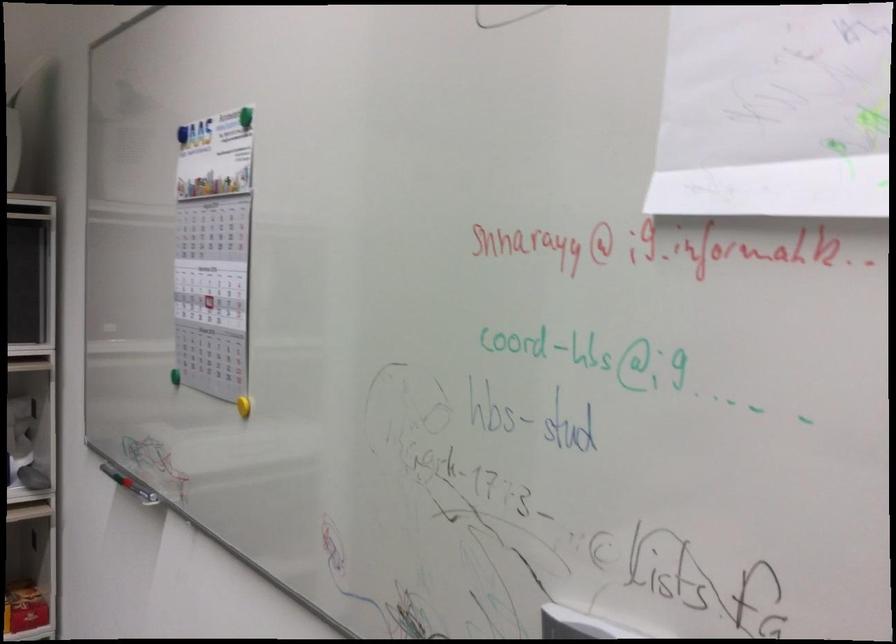
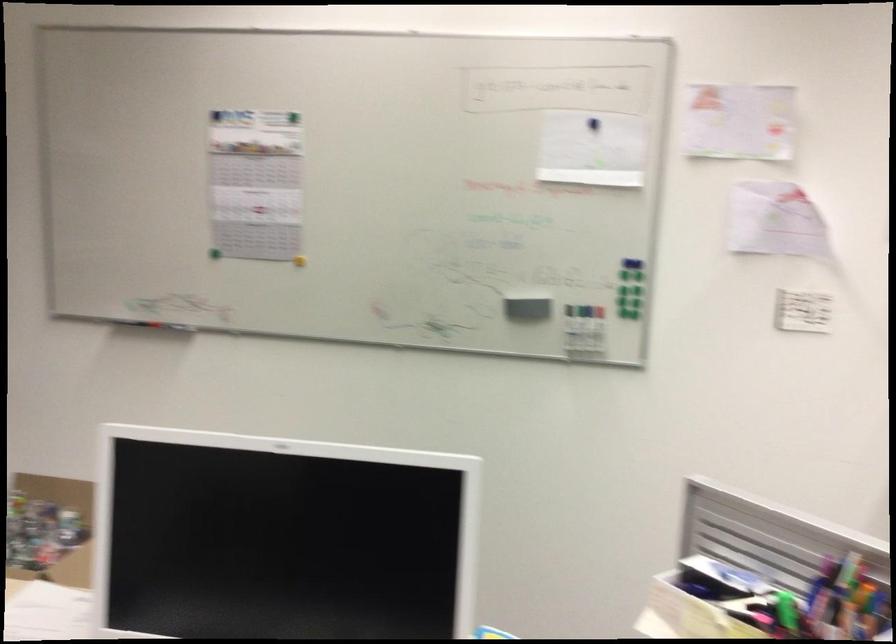
Find the pixel in the second image that matches pixel 240 131 in the first image.

(293, 118)